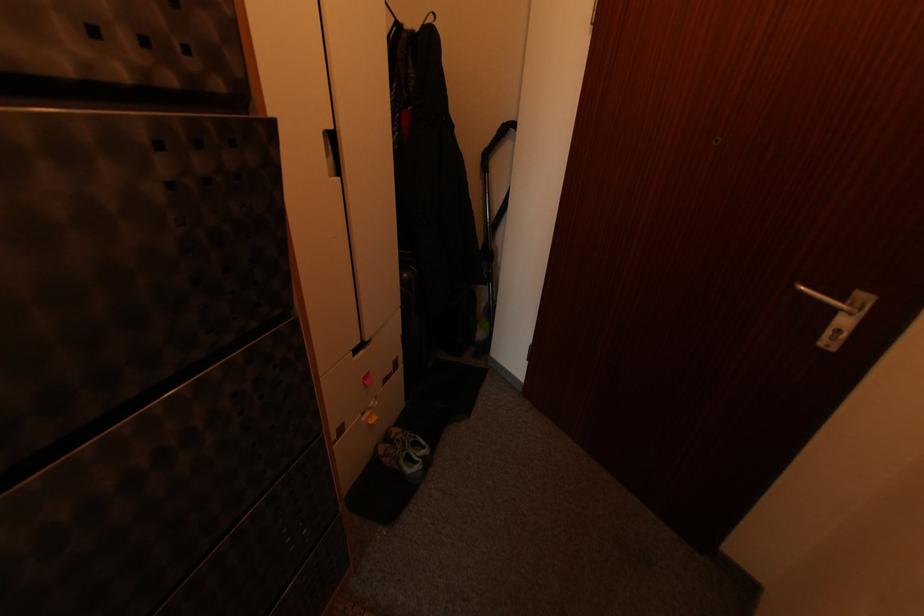
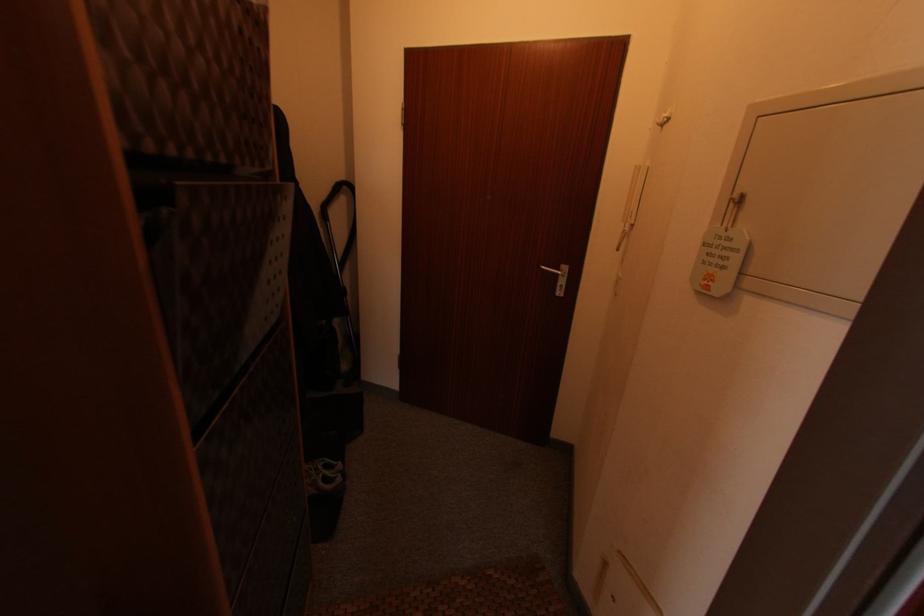
Question: The camera is either moving clockwise (left) or counter-clockwise (right) around the object. The first image is from the beginning of the video and the second image is from the end. Is the camera moving left or right when shooting the video?

Choices:
 (A) Left
 (B) Right

Answer: (A)